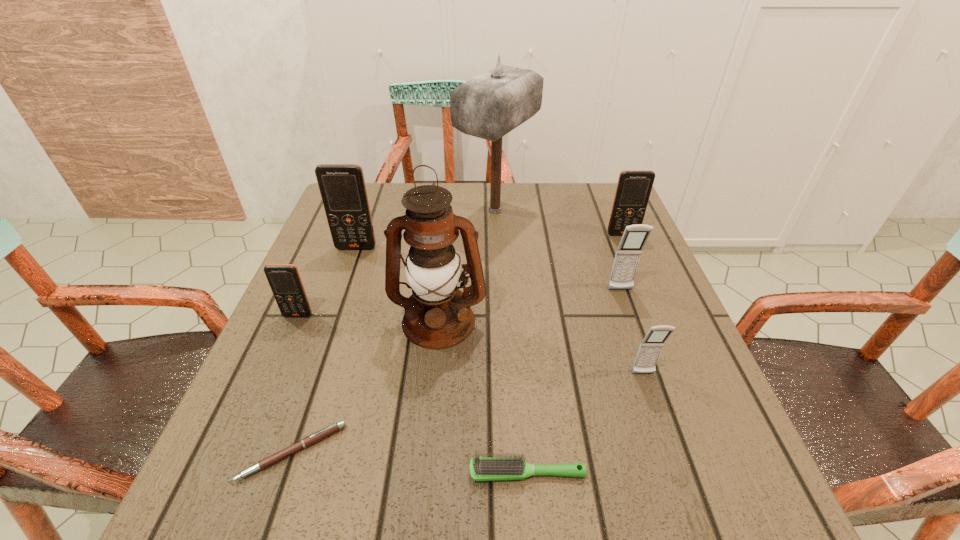
This screenshot has width=960, height=540. Find the location of `free space between the mallet and the third nearest object`. free space between the mallet and the third nearest object is located at coordinates (569, 292).

At what (x,y) coordinates should I click in order to perform the action: click on unoccupied area between the second farthest cellular telephone and the smallest orange cellular telephone. Please return your answer as a coordinate pair (x, y). The height and width of the screenshot is (540, 960). Looking at the image, I should click on (327, 281).

The height and width of the screenshot is (540, 960). I want to click on free space between the second farthest cellular telephone and the shortest object, so click(324, 350).

Find the location of `free space between the smaller gray cellular telephone and the brown lantern`. free space between the smaller gray cellular telephone and the brown lantern is located at coordinates (541, 347).

Where is `free spot between the light hairbrush and the brown lantern`? This screenshot has height=540, width=960. free spot between the light hairbrush and the brown lantern is located at coordinates (483, 397).

Locate an element on the screen. object that is the fourth closest to the mallet is located at coordinates (627, 257).

Identify which object is the fourth closest to the shortest object. Please provide its 2D coordinates. Your answer should be formatted as a tuple, i.e. [(x, y)], where the tuple contains the x and y coordinates of a point satisfying the conditions above.

[(342, 187)]

Where is `cellular telephone that can be found as the closest to the seventh shortest object`? cellular telephone that can be found as the closest to the seventh shortest object is located at coordinates (284, 279).

Locate an element on the screen. Image resolution: width=960 pixels, height=540 pixels. the fourth closest cellular telephone to the tallest cellular telephone is located at coordinates (650, 348).

Where is `orange cellular telephone that is the third closest one to the eighth tallest object`? The height and width of the screenshot is (540, 960). orange cellular telephone that is the third closest one to the eighth tallest object is located at coordinates (634, 187).